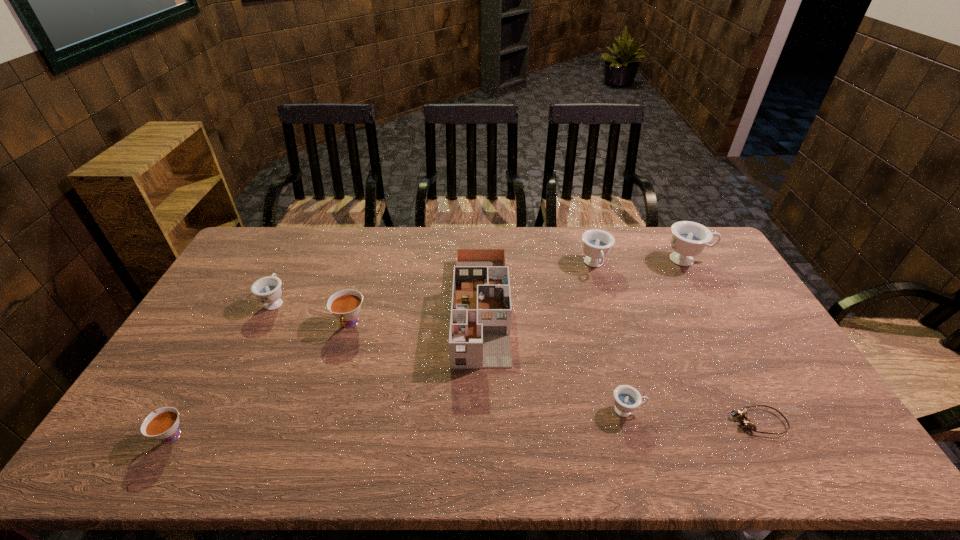
Locate an element on the screen. The height and width of the screenshot is (540, 960). free space located on the front lenses and sides of the goggles is located at coordinates (586, 422).

Find the location of `free spot located 0.110m on the front lenses and sides of the goggles`. free spot located 0.110m on the front lenses and sides of the goggles is located at coordinates (688, 422).

At what (x,y) coordinates should I click in order to perform the action: click on free space located on the front lenses and sides of the goggles. Please return your answer as a coordinate pair (x, y). Looking at the image, I should click on (664, 422).

Image resolution: width=960 pixels, height=540 pixels. What are the coordinates of `dollhouse that is positioned at the far edge` in the screenshot? It's located at (480, 324).

The width and height of the screenshot is (960, 540). I want to click on teacup present at the near edge, so click(x=164, y=425).

Image resolution: width=960 pixels, height=540 pixels. What are the coordinates of `goggles that is at the near edge` in the screenshot? It's located at (746, 423).

At what (x,y) coordinates should I click in order to perform the action: click on object that is positioned at the left edge. Please return your answer as a coordinate pair (x, y). Looking at the image, I should click on (164, 425).

The width and height of the screenshot is (960, 540). Identify the location of teacup present at the right edge. (689, 239).

Locate an element on the screen. This screenshot has height=540, width=960. goggles present at the right edge is located at coordinates (746, 423).

Locate an element on the screen. This screenshot has width=960, height=540. object that is at the near left corner is located at coordinates (164, 425).